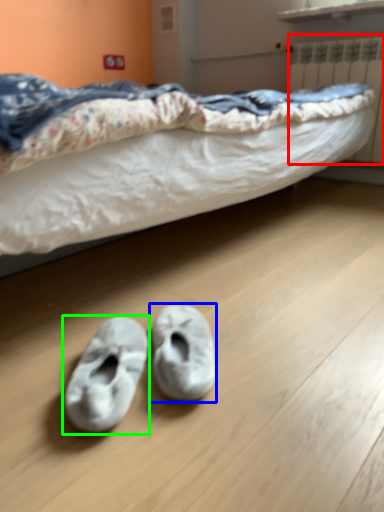
Question: Estimate the real-world distances between objects in this image. Which object is closer to radiator (highlighted by a red box), footwear (highlighted by a blue box) or footwear (highlighted by a green box)?

Choices:
 (A) footwear
 (B) footwear

Answer: (A)